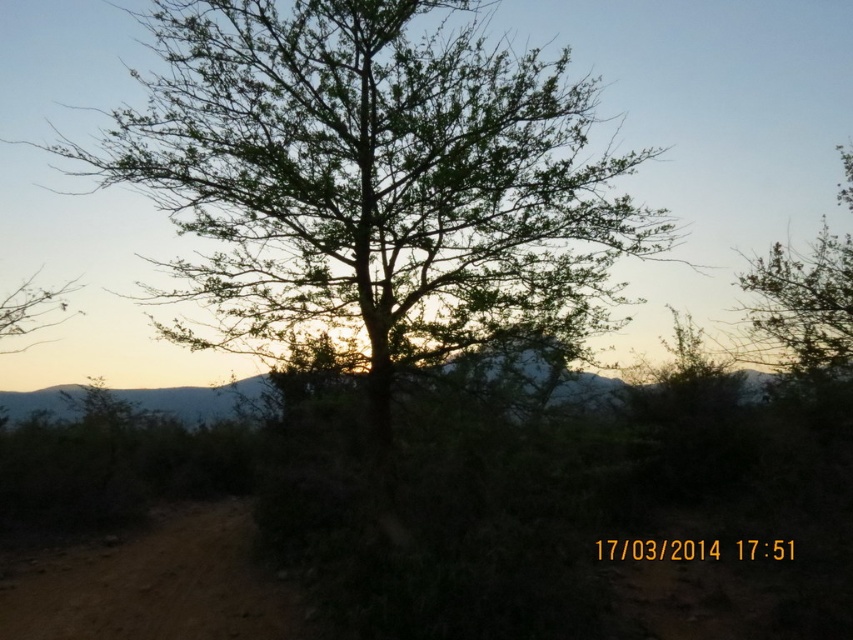
From the picture: You are standing in the serene outdoor scene and want to place a small decorative stone. You have two options for placement based on the coordinates given. Which coordinate point, point [231,120] or point [59,568], is closer to you where you are standing?

Point [231,120] is closer to the viewer than point [59,568], so the decorative stone placed at point [231,120] would be closer to you.

You are a hiker trying to follow the brown sandy dirt track at lower left to reach a campsite. However, you notice the green leafy tree at center blocking your path. Based on the scene, can you determine if the tree is between you and the track, or if the track is behind the tree?

The green leafy tree at center is in front of the brown sandy dirt track at lower left, so the tree is blocking your path and you need to go around it to reach the track.